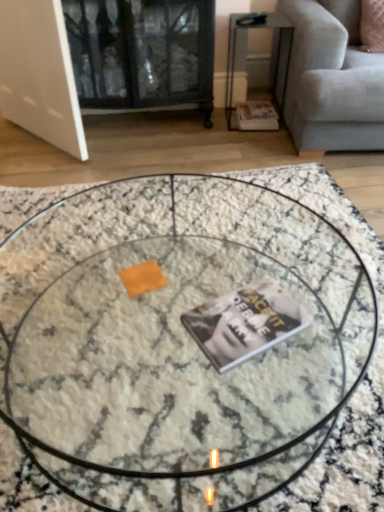
Locate an element on the screen. free space in front of hardcover book at center, the 1th magazine from the left is located at coordinates (247, 397).